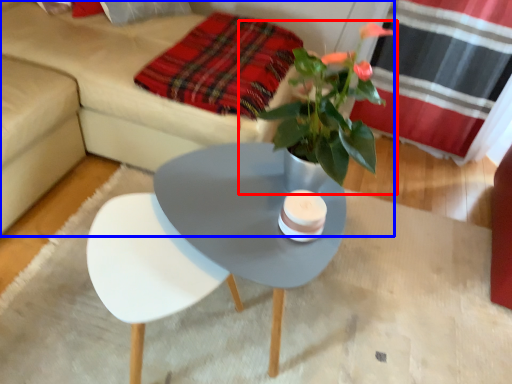
Question: Which object is closer to the camera taking this photo, houseplant (highlighted by a red box) or studio couch (highlighted by a blue box)?

Choices:
 (A) houseplant
 (B) studio couch

Answer: (A)